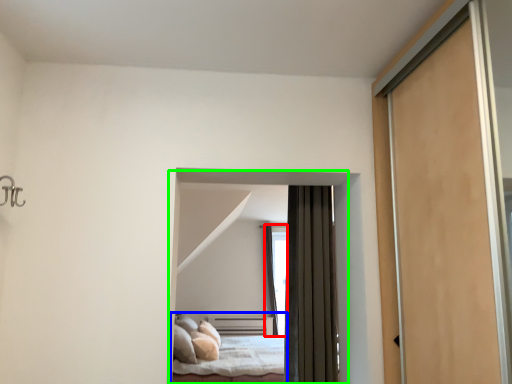
Question: Which object is the farthest from window (highlighted by a red box)? Choose among these: bed (highlighted by a blue box) or bed (highlighted by a green box).

Choices:
 (A) bed
 (B) bed

Answer: (B)